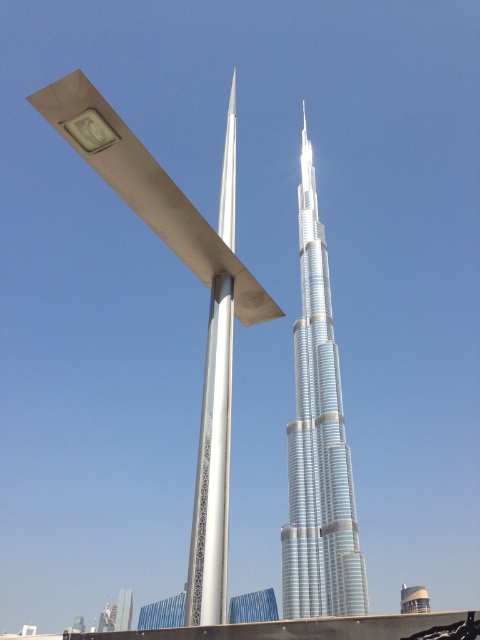
Question: Is silver metallic burj khalifa at center behind silver metallic pole at center?

Choices:
 (A) no
 (B) yes

Answer: (B)

Question: Is silver metallic burj khalifa at center smaller than silver metallic pole at center?

Choices:
 (A) yes
 (B) no

Answer: (B)

Question: Which of the following is the farthest from the observer?

Choices:
 (A) silver metallic burj khalifa at center
 (B) silver metallic pole at center

Answer: (A)

Question: Where is silver metallic burj khalifa at center located in relation to silver metallic pole at center in the image?

Choices:
 (A) right
 (B) left

Answer: (A)